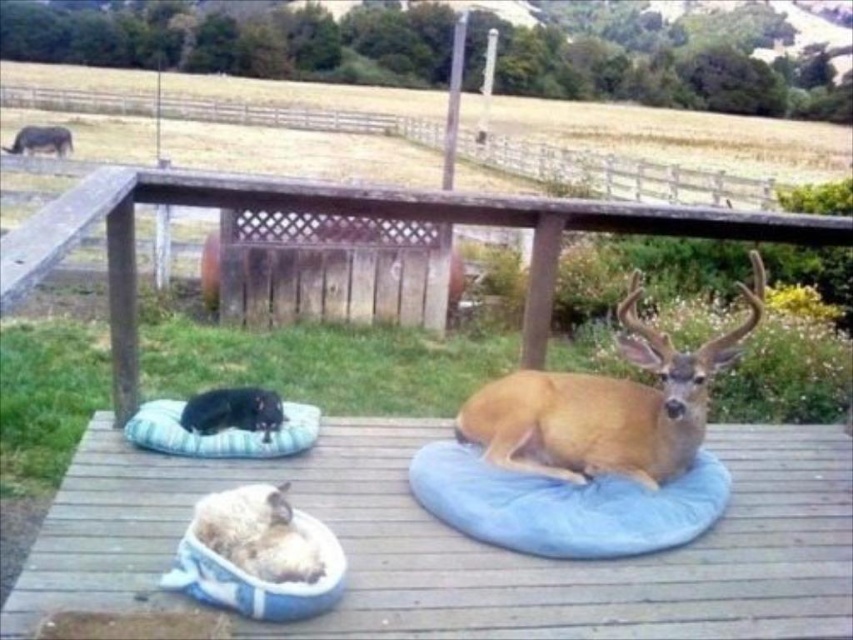
Who is more forward, (x=263, y=435) or (x=32, y=140)?

Point (x=263, y=435) is in front.

Locate an element on the screen. The width and height of the screenshot is (853, 640). blue fabric dog bed at lower left is located at coordinates (221, 433).

Where is `blue fabric dog bed at lower left`? Image resolution: width=853 pixels, height=640 pixels. blue fabric dog bed at lower left is located at coordinates (221, 433).

Which is in front, point (537, 586) or point (598, 532)?

Positioned in front is point (537, 586).

Which of these two, wooden deck at center or blue plush dog bed at center, stands shorter?

Standing shorter between the two is blue plush dog bed at center.

Does point (38, 589) come closer to viewer compared to point (686, 520)?

Yes, point (38, 589) is closer to viewer.

Find the location of a particular element. The width and height of the screenshot is (853, 640). wooden deck at center is located at coordinates (463, 544).

Does golden brown fur at center lie behind black fur cat at lower left?

No, it is not.

Between golden brown fur at center and black fur cat at lower left, which one appears on the left side from the viewer's perspective?

black fur cat at lower left is more to the left.

Locate an element on the screen. This screenshot has width=853, height=640. golden brown fur at center is located at coordinates (606, 406).

You are a GUI agent. You are given a task and a screenshot of the screen. Output one action in this format:
    pyautogui.click(x=<x>, y=<y>)
    Task: Click on the golden brown fur at center
    The width and height of the screenshot is (853, 640).
    Given the screenshot: What is the action you would take?
    pyautogui.click(x=606, y=406)